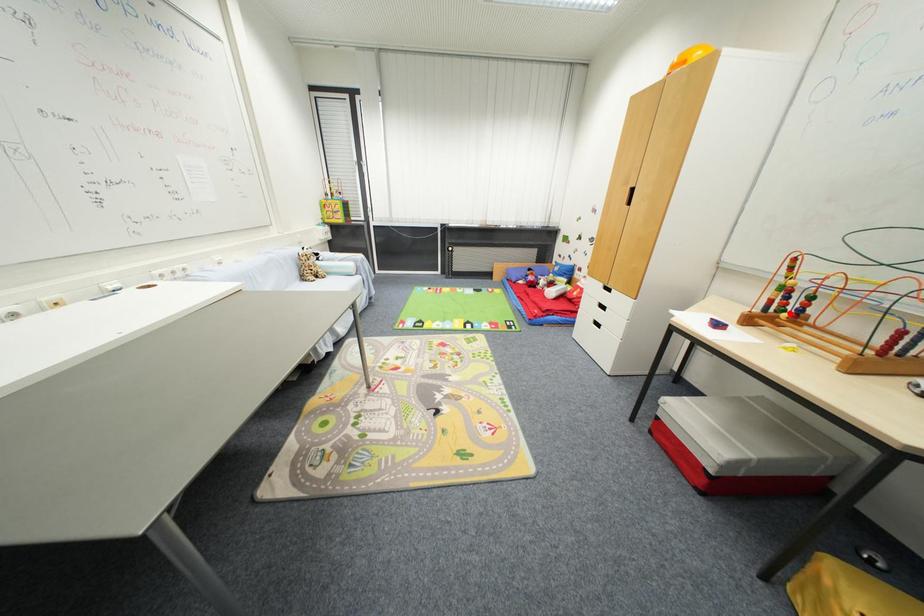
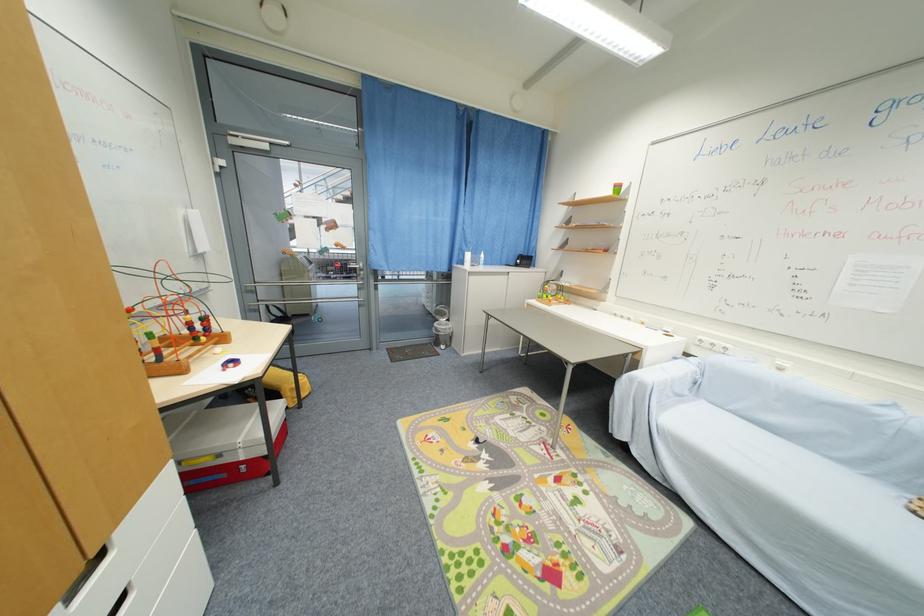
Locate, in the second image, the point that corresponds to the highlighted location in the first image.

(201, 341)